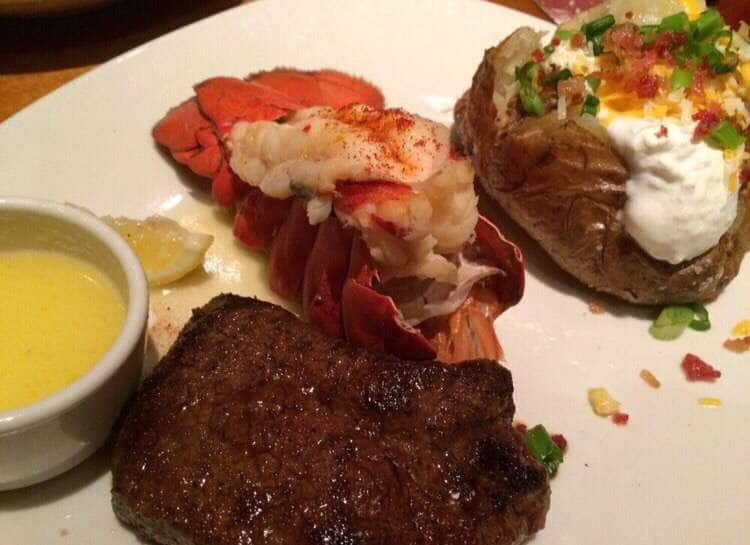
Where is `white plate`? Image resolution: width=750 pixels, height=545 pixels. white plate is located at coordinates (571, 393).